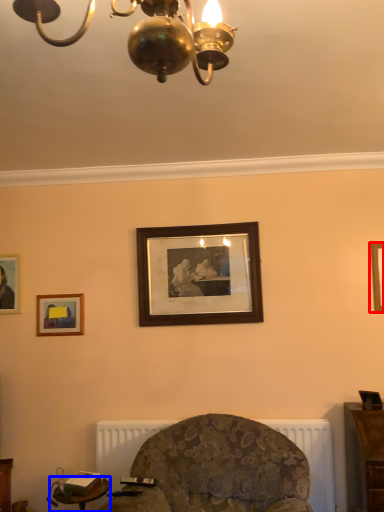
Question: Which point is closer to the camera, picture frame (highlighted by a red box) or table (highlighted by a blue box)?

Choices:
 (A) picture frame
 (B) table

Answer: (B)